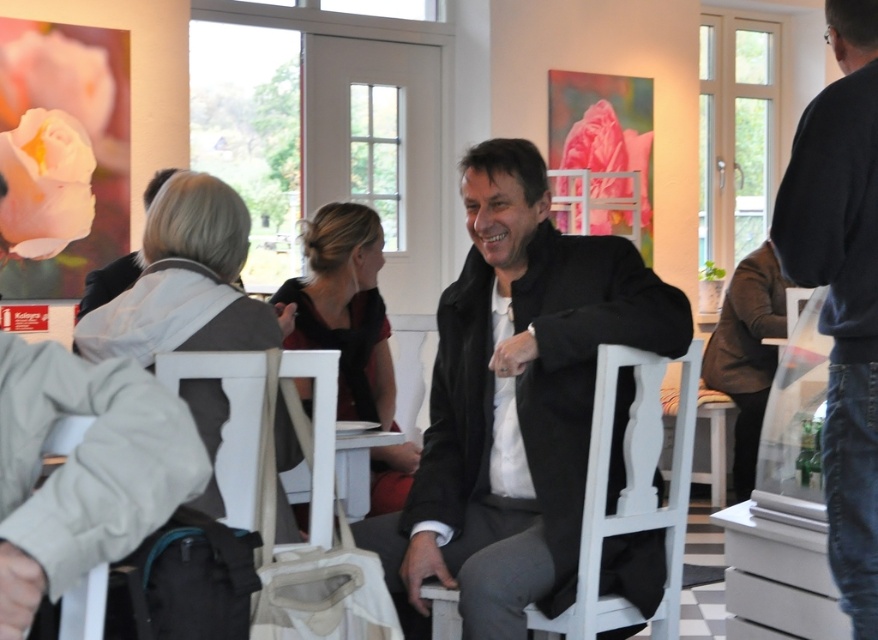
Can you confirm if black matte jacket at center is positioned to the left of matte black jacket at center?

In fact, black matte jacket at center is to the right of matte black jacket at center.

Does black matte jacket at center come in front of matte black jacket at center?

Yes, black matte jacket at center is closer to the viewer.

Describe the element at coordinates (515, 401) in the screenshot. I see `black matte jacket at center` at that location.

In order to click on black matte jacket at center in this screenshot , I will do `click(515, 401)`.

Between point (523, 624) and point (224, 436), which one is positioned behind?

Point (523, 624)

Between point (632, 460) and point (256, 449), which one is positioned in front?

Point (256, 449) is in front.

Where is `white wood chair at center`? The height and width of the screenshot is (640, 878). white wood chair at center is located at coordinates (631, 492).

Is white wood chair at lower left smaller than matte black jacket at center?

No.

Where is `white wood chair at lower left`? white wood chair at lower left is located at coordinates (229, 420).

The height and width of the screenshot is (640, 878). In order to click on white wood chair at lower left in this screenshot , I will do `click(229, 420)`.